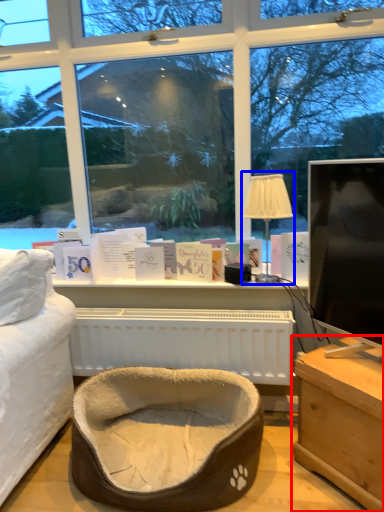
Question: Which of the following is the closest to the observer, table (highlighted by a red box) or table lamp (highlighted by a blue box)?

Choices:
 (A) table
 (B) table lamp

Answer: (A)